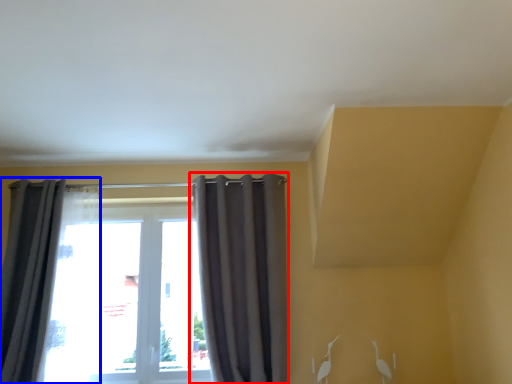
Question: Among these objects, which one is farthest to the camera, curtain (highlighted by a red box) or curtain (highlighted by a blue box)?

Choices:
 (A) curtain
 (B) curtain

Answer: (A)